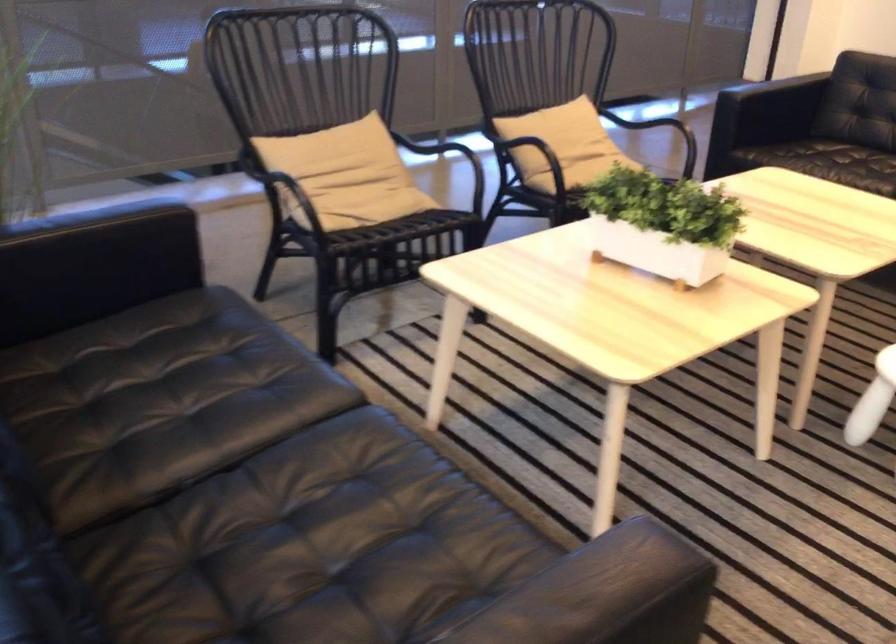
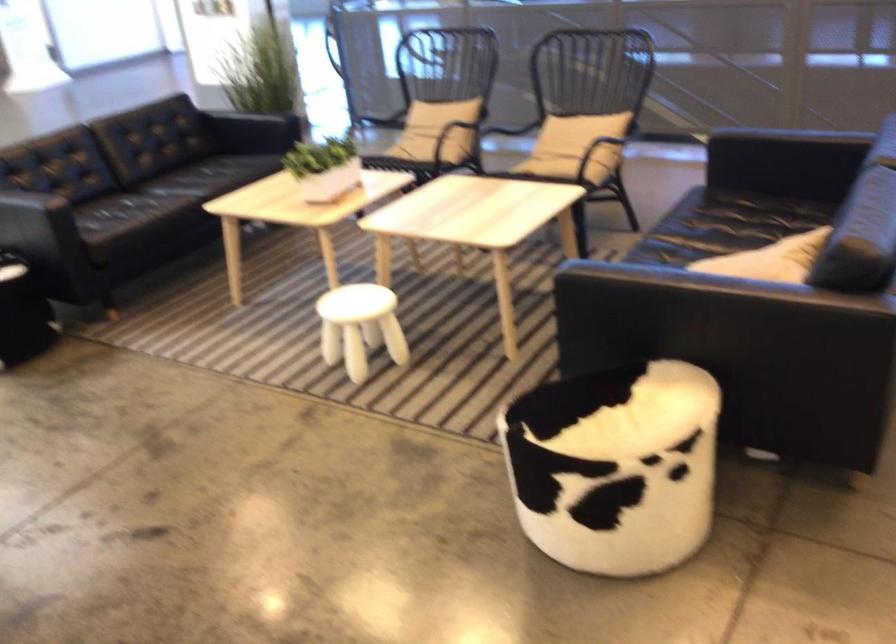
Find the pixel in the second image that matches (607,165) in the first image.

(552, 160)